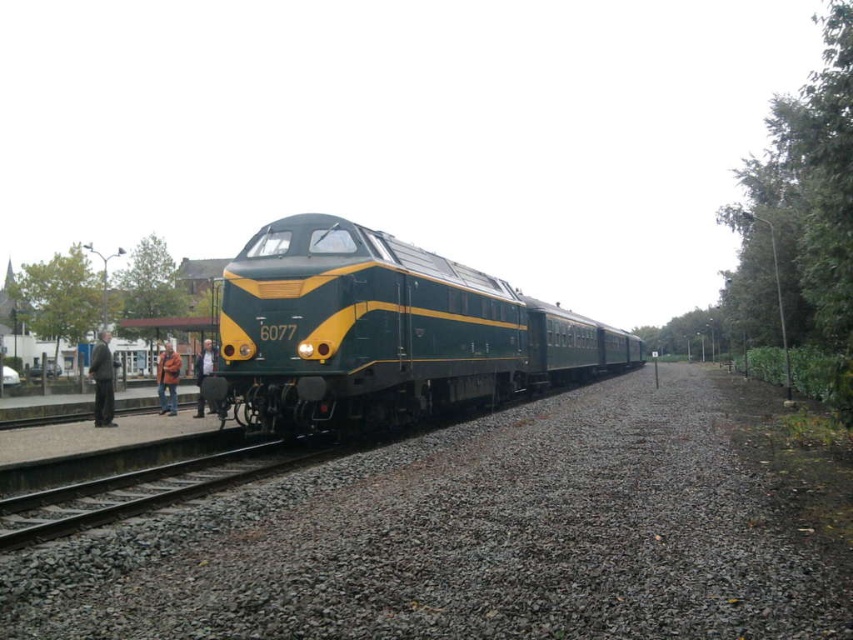
Question: Which object appears farthest from the camera in this image?

Choices:
 (A) dark gray suit at left
 (B) brown leather jacket at lower left
 (C) gray gravel at center

Answer: (B)

Question: Based on their relative distances, which object is farther from the gray gravel at center?

Choices:
 (A) green polished metal train at center
 (B) dark gray suit at left

Answer: (A)

Question: Is gray gravel at center below dark gray jacket at left?

Choices:
 (A) yes
 (B) no

Answer: (A)

Question: Can you confirm if gray gravel at center is smaller than gray gravel track at lower left?

Choices:
 (A) yes
 (B) no

Answer: (B)

Question: Which of the following is the closest to the observer?

Choices:
 (A) dark gray jacket at left
 (B) gray gravel at center
 (C) green polished metal train at center
 (D) brown leather jacket at lower left

Answer: (B)

Question: Does gray gravel at center have a smaller size compared to dark gray suit at left?

Choices:
 (A) yes
 (B) no

Answer: (A)